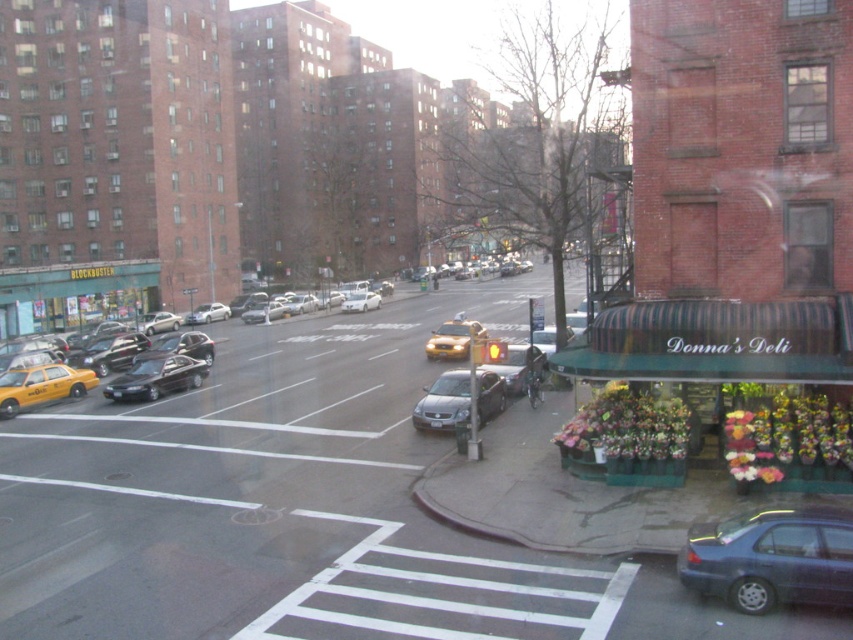
Does shiny black sedan at center-left have a larger size compared to yellow matte taxi at center?

No, shiny black sedan at center-left is not bigger than yellow matte taxi at center.

Does shiny black sedan at center-left have a lesser height compared to yellow matte taxi at center?

Indeed, shiny black sedan at center-left has a lesser height compared to yellow matte taxi at center.

Does point (143, 394) lie in front of point (457, 330)?

Yes, point (143, 394) is closer to viewer.

Locate an element on the screen. This screenshot has width=853, height=640. shiny black sedan at center-left is located at coordinates (155, 378).

Locate an element on the screen. shiny black sedan at center is located at coordinates (178, 346).

Who is positioned more to the left, shiny black sedan at center or white matte sedan at center?

shiny black sedan at center is more to the left.

Describe the element at coordinates (178, 346) in the screenshot. I see `shiny black sedan at center` at that location.

In order to click on shiny black sedan at center in this screenshot , I will do `click(178, 346)`.

Who is higher up, shiny black sedan at center-left or silver metallic sedan at center?

Positioned higher is silver metallic sedan at center.

Locate an element on the screen. shiny black sedan at center-left is located at coordinates (155, 378).

Between point (173, 356) and point (204, 316), which one is positioned in front?

Point (173, 356) is in front.

The height and width of the screenshot is (640, 853). I want to click on shiny black sedan at center-left, so click(155, 378).